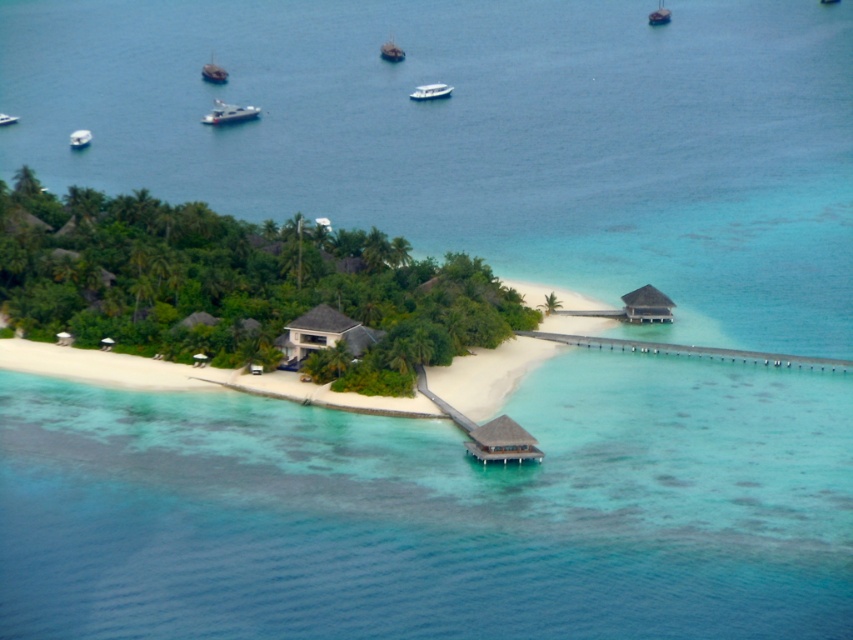
Question: Considering the relative positions of metallic silver boat at upper left and metallic silver boat at center in the image provided, where is metallic silver boat at upper left located with respect to metallic silver boat at center?

Choices:
 (A) above
 (B) below

Answer: (B)

Question: From the image, what is the correct spatial relationship of matte brown hut at center in relation to metallic silver boat at upper center?

Choices:
 (A) right
 (B) left

Answer: (A)

Question: Observing the image, what is the correct spatial positioning of white glossy boat at upper center in reference to metallic silver boat at upper center?

Choices:
 (A) above
 (B) below

Answer: (B)

Question: Which of the following is the farthest from the observer?

Choices:
 (A) matte brown hut at center
 (B) metallic silver boat at upper center
 (C) white glossy boat at center
 (D) white glossy boat at upper center

Answer: (B)

Question: Which object is positioned closest to the metallic gray boat at upper left?

Choices:
 (A) brown thatched hut at center
 (B) white glossy boat at upper left

Answer: (B)

Question: Which object is closer to the camera taking this photo?

Choices:
 (A) matte brown hut at center
 (B) metallic silver boat at upper center
 (C) brown thatched hut at center
 (D) metallic silver boat at center

Answer: (C)